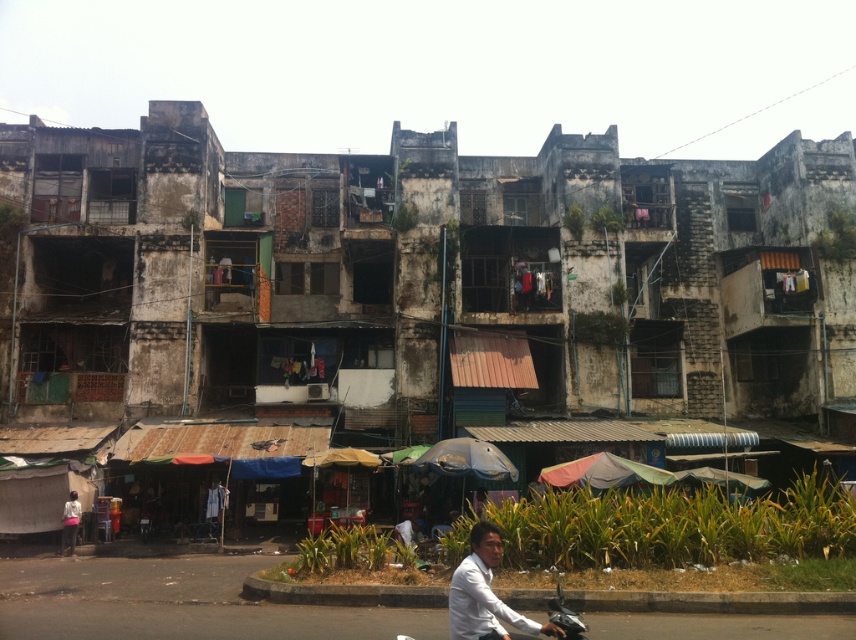
Question: Is rusty metal hut at lower center above white matte shirt at lower center?

Choices:
 (A) no
 (B) yes

Answer: (B)

Question: Among these points, which one is farthest from the camera?

Choices:
 (A) (482, 582)
 (B) (381, 205)
 (C) (70, 513)

Answer: (B)

Question: Is white matte shirt at lower center above metallic silver motorcycle at lower center?

Choices:
 (A) no
 (B) yes

Answer: (B)

Question: Is metallic silver motorcycle at lower center positioned at the back of white matte shirt at lower left?

Choices:
 (A) yes
 (B) no

Answer: (B)

Question: Estimate the real-world distances between objects in this image. Which object is farther from the white matte shirt at lower left?

Choices:
 (A) metallic silver motorcycle at lower center
 (B) rusty metal hut at lower center
 (C) white matte shirt at lower center

Answer: (A)

Question: Which of the following is the farthest from the observer?

Choices:
 (A) rusty metal hut at lower center
 (B) metallic silver motorcycle at lower center
 (C) white matte shirt at lower center
 (D) white matte shirt at lower left

Answer: (A)